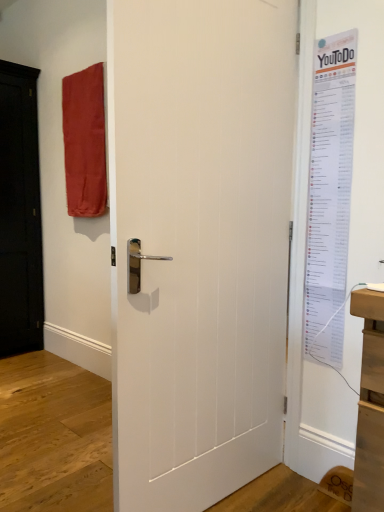
Question: Is white matte door at center oriented towards white paper poster at right?

Choices:
 (A) yes
 (B) no

Answer: (A)

Question: Is white matte door at center positioned before white paper poster at right?

Choices:
 (A) yes
 (B) no

Answer: (A)

Question: Would you consider white matte door at center to be distant from white paper poster at right?

Choices:
 (A) no
 (B) yes

Answer: (A)

Question: Is white matte door at center in contact with white paper poster at right?

Choices:
 (A) yes
 (B) no

Answer: (B)

Question: From the image's perspective, is white matte door at center beneath white paper poster at right?

Choices:
 (A) no
 (B) yes

Answer: (B)

Question: Is white matte door at center inside the boundaries of matte red fabric at upper left, or outside?

Choices:
 (A) outside
 (B) inside

Answer: (A)

Question: From a real-world perspective, is white matte door at center positioned above or below matte red fabric at upper left?

Choices:
 (A) above
 (B) below

Answer: (B)

Question: Is white matte door at center wider or thinner than matte red fabric at upper left?

Choices:
 (A) thin
 (B) wide

Answer: (A)

Question: Is white matte door at center in front of or behind matte red fabric at upper left in the image?

Choices:
 (A) front
 (B) behind

Answer: (A)

Question: Which is correct: matte red fabric at upper left is inside white matte door at center, or outside of it?

Choices:
 (A) inside
 (B) outside

Answer: (B)

Question: From a real-world perspective, is matte red fabric at upper left physically located above or below white matte door at center?

Choices:
 (A) below
 (B) above

Answer: (B)

Question: In terms of size, does matte red fabric at upper left appear bigger or smaller than white matte door at center?

Choices:
 (A) big
 (B) small

Answer: (B)

Question: Does point (79, 199) appear closer or farther from the camera than point (177, 5)?

Choices:
 (A) farther
 (B) closer

Answer: (A)

Question: Is white paper poster at right in front of or behind white matte door at center in the image?

Choices:
 (A) front
 (B) behind

Answer: (B)

Question: Is point (321, 292) closer or farther from the camera than point (183, 280)?

Choices:
 (A) farther
 (B) closer

Answer: (A)